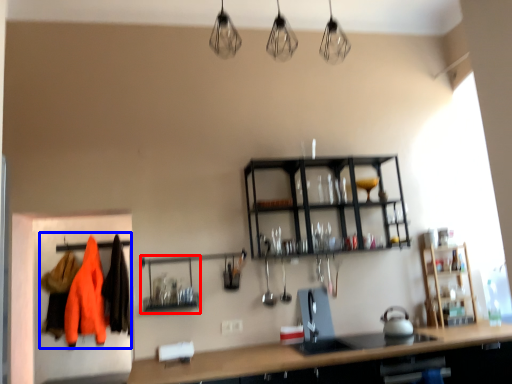
Question: Which object appears farthest to the camera in this image, shelf (highlighted by a red box) or clothing (highlighted by a blue box)?

Choices:
 (A) shelf
 (B) clothing

Answer: (B)